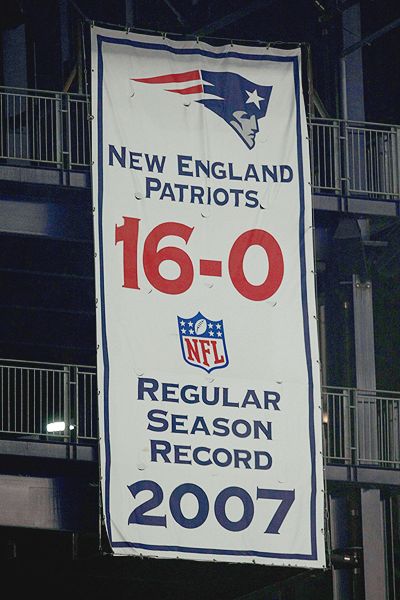
The width and height of the screenshot is (400, 600). Find the location of `lighting`. lighting is located at coordinates (57, 423), (326, 420).